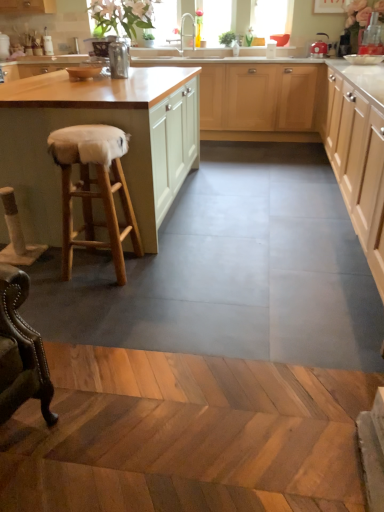
Question: Considering the relative positions of transparent glass window screen at upper center and wooden stool at left in the image provided, is transparent glass window screen at upper center behind wooden stool at left?

Choices:
 (A) no
 (B) yes

Answer: (B)

Question: Can you confirm if transparent glass window screen at upper center is positioned to the right of wooden stool at left?

Choices:
 (A) no
 (B) yes

Answer: (B)

Question: Can you see transparent glass window screen at upper center touching wooden stool at left?

Choices:
 (A) no
 (B) yes

Answer: (A)

Question: Can you confirm if transparent glass window screen at upper center is taller than wooden stool at left?

Choices:
 (A) no
 (B) yes

Answer: (A)

Question: Is transparent glass window screen at upper center not within wooden stool at left?

Choices:
 (A) yes
 (B) no

Answer: (A)

Question: Is wooden stool at left at the back of transparent glass window screen at upper center?

Choices:
 (A) no
 (B) yes

Answer: (A)

Question: Can you confirm if matte red kettle at upper right is positioned to the left of matte white cabinets at center, which is the second cabinetry in left-to-right order?

Choices:
 (A) no
 (B) yes

Answer: (A)

Question: Does matte red kettle at upper right have a greater width compared to matte white cabinets at center, which is the second cabinetry in left-to-right order?

Choices:
 (A) yes
 (B) no

Answer: (B)

Question: Would you say matte red kettle at upper right is outside matte white cabinets at center, which is the second cabinetry in left-to-right order?

Choices:
 (A) no
 (B) yes

Answer: (B)

Question: Is matte red kettle at upper right turned away from matte white cabinets at center, which is the 2th cabinetry in right-to-left order?

Choices:
 (A) no
 (B) yes

Answer: (A)

Question: Does matte red kettle at upper right turn towards matte white cabinets at center, which is the second cabinetry in left-to-right order?

Choices:
 (A) no
 (B) yes

Answer: (A)

Question: Can you confirm if matte red kettle at upper right is smaller than matte white cabinets at center, which is the 2th cabinetry in right-to-left order?

Choices:
 (A) no
 (B) yes

Answer: (B)

Question: Considering the relative sizes of matte white cabinets at center, which is the 2th cabinetry in right-to-left order, and transparent glass window screen at upper center in the image provided, is matte white cabinets at center, which is the 2th cabinetry in right-to-left order, taller than transparent glass window screen at upper center?

Choices:
 (A) yes
 (B) no

Answer: (A)